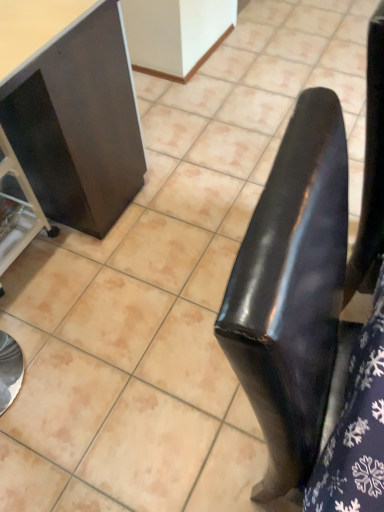
Find the location of a particular element. The image size is (384, 512). spots to the right of matte black cabinet at left, placed as the 2th furniture when sorted from left to right is located at coordinates point(170,241).